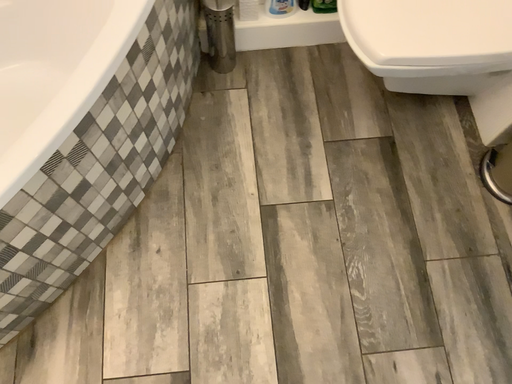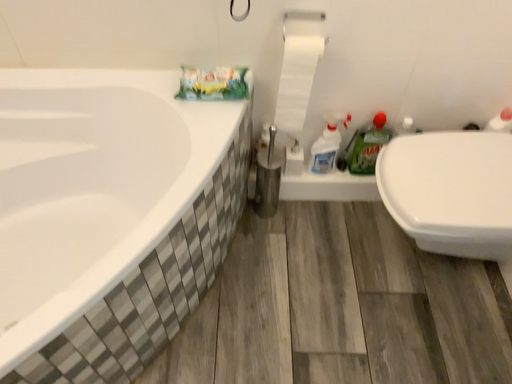
Question: Which way did the camera rotate in the video?

Choices:
 (A) rotated upward
 (B) rotated downward

Answer: (A)